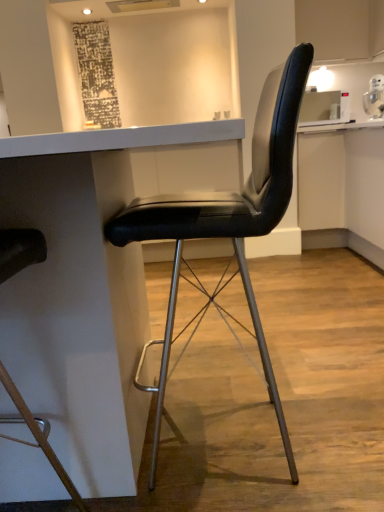
The image size is (384, 512). What are the coordinates of `vacant area situated below black leather chair at center, the 2th chair positioned from the left (from a real-world perspective)` in the screenshot? It's located at (274, 434).